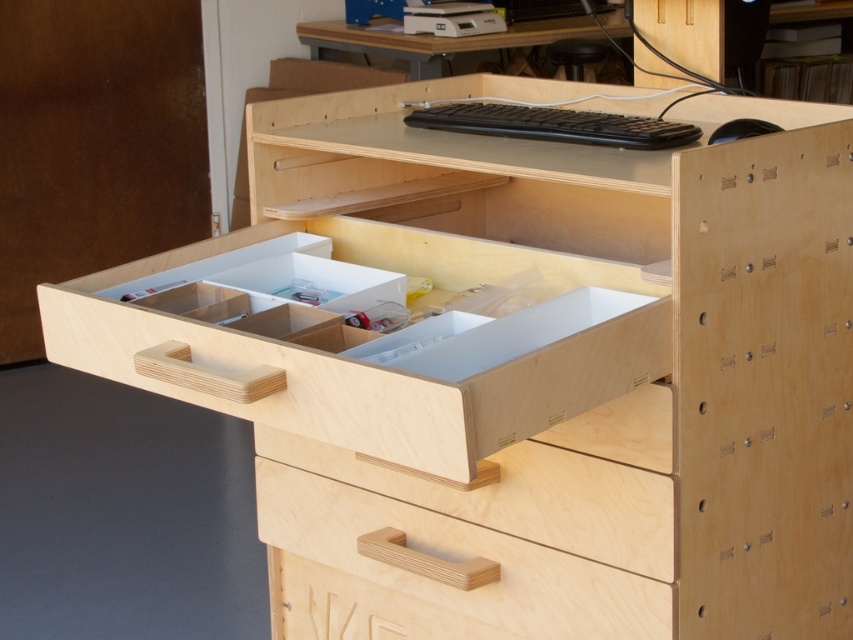
Who is lower down, plywood drawer at center or black matte keyboard at upper center?

Positioned lower is plywood drawer at center.

Between point (219, 284) and point (527, 113), which one is positioned in front?

Point (219, 284)

Find the location of a particular element. The height and width of the screenshot is (640, 853). plywood drawer at center is located at coordinates click(389, 342).

Can you confirm if matte wood table at upper center is wider than black matte keyboard at upper center?

Correct, the width of matte wood table at upper center exceeds that of black matte keyboard at upper center.

Is point (352, 38) behind point (547, 109)?

Yes.

Does point (329, 28) come farther from viewer compared to point (630, 120)?

Yes, point (329, 28) is farther from viewer.

You are a GUI agent. You are given a task and a screenshot of the screen. Output one action in this format:
    pyautogui.click(x=<x>, y=<y>)
    Task: Click on the matte wood table at upper center
    
    Given the screenshot: What is the action you would take?
    pyautogui.click(x=432, y=40)

Can you confirm if plywood drawer at center is wider than black plastic mouse at upper right?

Yes.

Is plywood drawer at center smaller than black plastic mouse at upper right?

No.

Image resolution: width=853 pixels, height=640 pixels. Find the location of `plywood drawer at center`. plywood drawer at center is located at coordinates (389, 342).